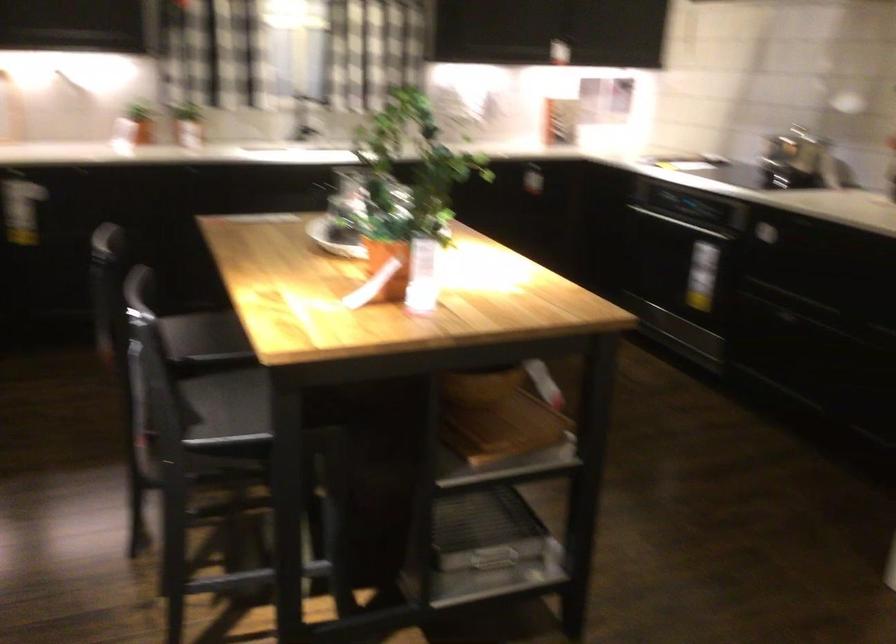
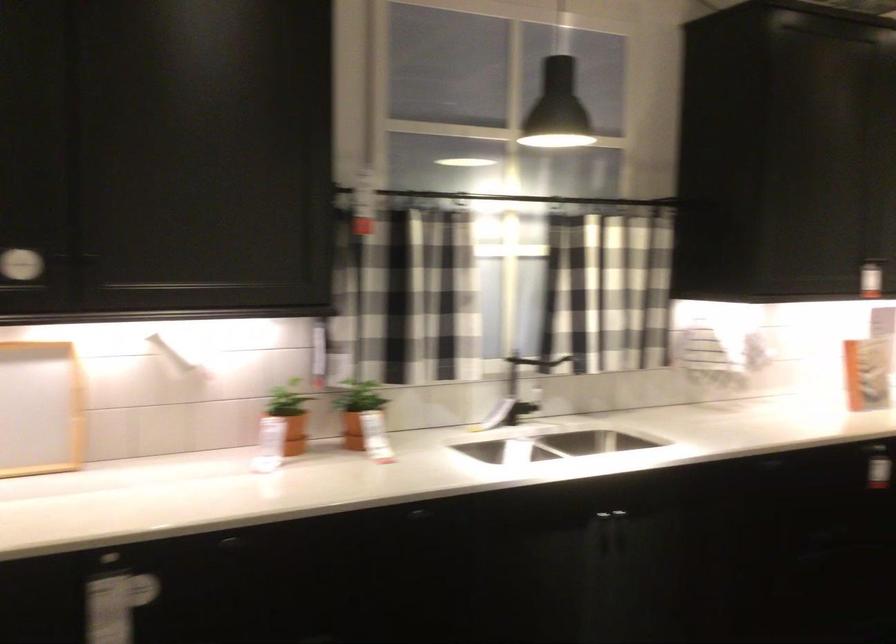
The point at (306, 98) is marked in the first image. Where is the corresponding point in the second image?

(520, 370)